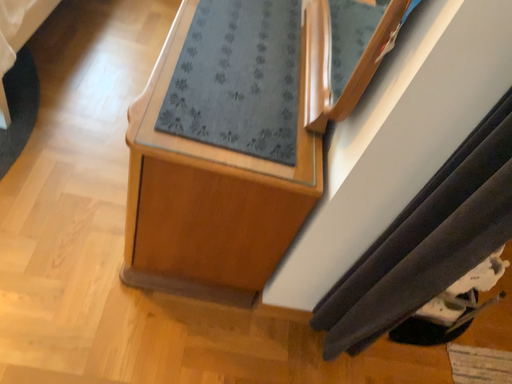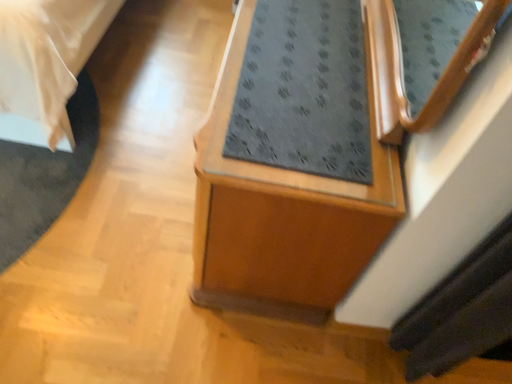
Question: How did the camera likely rotate when shooting the video?

Choices:
 (A) rotated right
 (B) rotated left

Answer: (B)